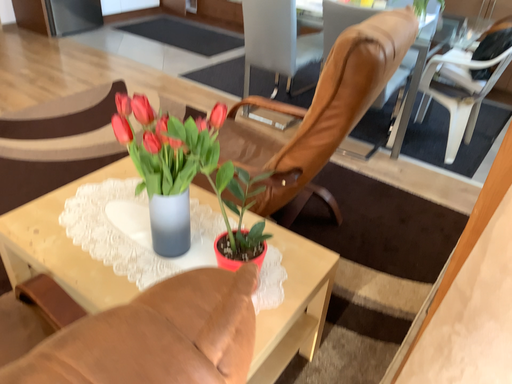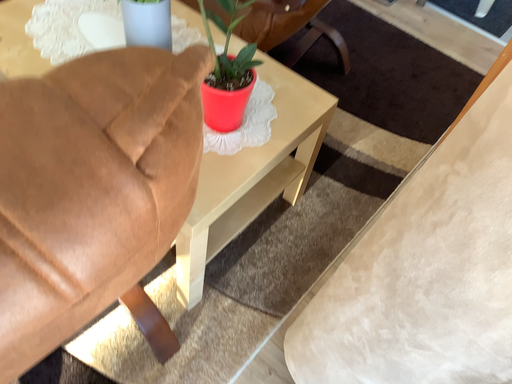
Question: How did the camera likely rotate when shooting the video?

Choices:
 (A) rotated upward
 (B) rotated downward

Answer: (B)